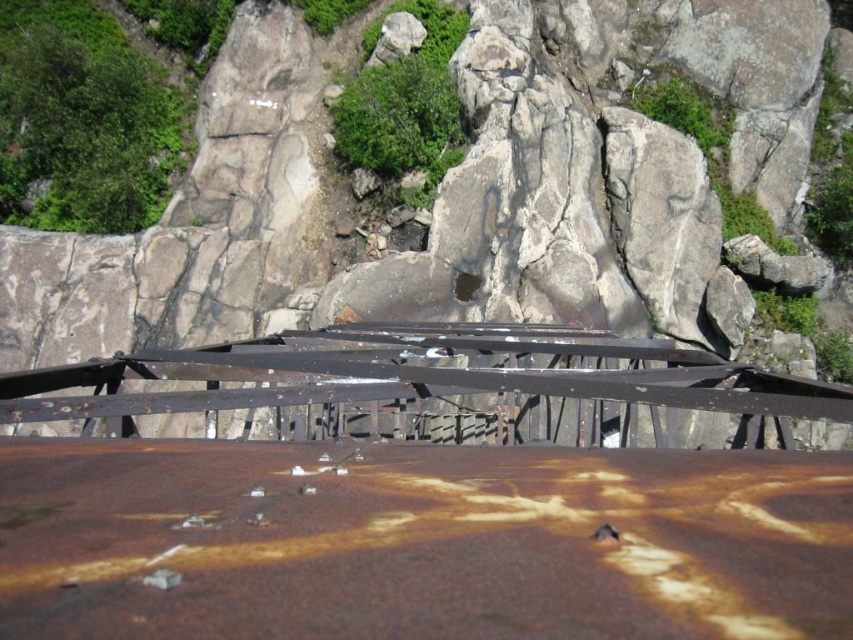
Which is below, rusty metal surface at center or rusty metal railing at center?

rusty metal surface at center is below.

Who is more distant from viewer, (x=314, y=620) or (x=579, y=220)?

Positioned behind is point (x=579, y=220).

Find the location of a particular element. rusty metal surface at center is located at coordinates (421, 541).

You are a GUI agent. You are given a task and a screenshot of the screen. Output one action in this format:
    pyautogui.click(x=<x>, y=<y>)
    Task: Click on the rusty metal surface at center
    This screenshot has width=853, height=640.
    Given the screenshot: What is the action you would take?
    point(421,541)

Does point (526, 61) lie behind point (511, 326)?

Yes, point (526, 61) is behind point (511, 326).

Between rusty metal railing at center and rusty metal bridge at center, which one is positioned lower?

Positioned lower is rusty metal bridge at center.

This screenshot has height=640, width=853. Describe the element at coordinates (550, 209) in the screenshot. I see `rusty metal railing at center` at that location.

The width and height of the screenshot is (853, 640). Identify the location of rusty metal railing at center. (550, 209).

Which is behind, point (51, 609) or point (775, 403)?

The point (775, 403) is behind.

From the picture: Between rusty metal surface at center and rusty metal bridge at center, which one has more height?

rusty metal bridge at center is taller.

Who is more distant from viewer, (216, 624) or (480, 349)?

The point (480, 349) is behind.

In order to click on rusty metal surface at center in this screenshot , I will do `click(421, 541)`.